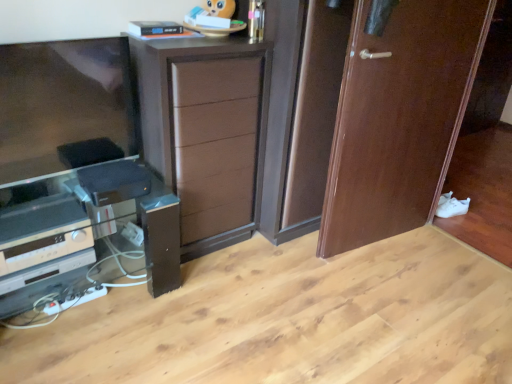
Identify the location of vacant location behind white matte shoe at lower right. The height and width of the screenshot is (384, 512). (454, 202).